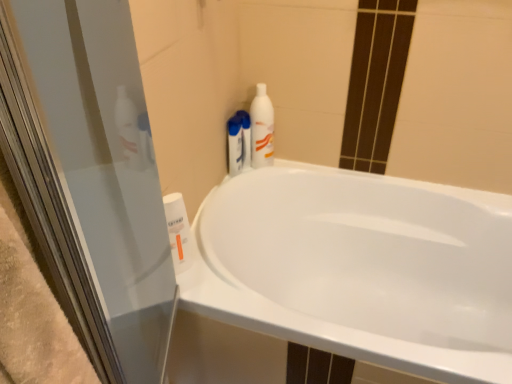
Question: Is white glossy bottle at upper right, which appears as the 2th cleaning product when viewed from the top, positioned behind white glossy bottle at upper right, the first cleaning product viewed from the right?

Choices:
 (A) no
 (B) yes

Answer: (B)

Question: Considering the relative sizes of white glossy bottle at upper right, positioned as the 2th cleaning product in bottom-to-top order, and white glossy bottle at upper right, which is the second cleaning product from front to back, in the image provided, is white glossy bottle at upper right, positioned as the 2th cleaning product in bottom-to-top order, shorter than white glossy bottle at upper right, which is the second cleaning product from front to back,?

Choices:
 (A) no
 (B) yes

Answer: (B)

Question: Considering the relative sizes of white glossy bottle at upper right, which appears as the 2th cleaning product when viewed from the top, and white glossy bottle at upper right, the second cleaning product viewed from the back, in the image provided, is white glossy bottle at upper right, which appears as the 2th cleaning product when viewed from the top, wider than white glossy bottle at upper right, the second cleaning product viewed from the back,?

Choices:
 (A) no
 (B) yes

Answer: (A)

Question: Are white glossy bottle at upper right, positioned as the 2th cleaning product in bottom-to-top order, and white glossy bottle at upper right, the second cleaning product viewed from the back, making contact?

Choices:
 (A) no
 (B) yes

Answer: (B)

Question: Considering the relative sizes of white glossy bottle at upper right, arranged as the second cleaning product when viewed from the left, and white glossy bottle at upper right, which is counted as the third cleaning product, starting from the left, in the image provided, is white glossy bottle at upper right, arranged as the second cleaning product when viewed from the left, taller than white glossy bottle at upper right, which is counted as the third cleaning product, starting from the left,?

Choices:
 (A) no
 (B) yes

Answer: (A)

Question: Considering the relative positions of white glossy bathtub at center and white glossy bottle at lower left, the third cleaning product positioned from the back, in the image provided, is white glossy bathtub at center to the left or to the right of white glossy bottle at lower left, the third cleaning product positioned from the back,?

Choices:
 (A) right
 (B) left

Answer: (A)

Question: Considering the positions of point (243, 296) and point (165, 206), is point (243, 296) closer or farther from the camera than point (165, 206)?

Choices:
 (A) closer
 (B) farther

Answer: (B)

Question: From a real-world perspective, is white glossy bathtub at center positioned above or below white glossy bottle at lower left, the third cleaning product positioned from the back?

Choices:
 (A) above
 (B) below

Answer: (B)

Question: Is white glossy bathtub at center situated inside white glossy bottle at lower left, which is the 1th cleaning product in front-to-back order, or outside?

Choices:
 (A) outside
 (B) inside

Answer: (A)

Question: From the image's perspective, is white glossy bottle at lower left, placed as the third cleaning product when sorted from top to bottom, above or below white glossy bottle at upper right, positioned as the 2th cleaning product in bottom-to-top order?

Choices:
 (A) above
 (B) below

Answer: (B)

Question: Visually, is white glossy bottle at lower left, which ranks as the first cleaning product in left-to-right order, positioned to the left or to the right of white glossy bottle at upper right, the third cleaning product when ordered from front to back?

Choices:
 (A) right
 (B) left

Answer: (B)

Question: From their relative heights in the image, would you say white glossy bottle at lower left, the third cleaning product when ordered from right to left, is taller or shorter than white glossy bottle at upper right, arranged as the second cleaning product when viewed from the left?

Choices:
 (A) tall
 (B) short

Answer: (A)

Question: Is white glossy bottle at lower left, the third cleaning product when ordered from right to left, inside the boundaries of white glossy bottle at upper right, the third cleaning product when ordered from front to back, or outside?

Choices:
 (A) inside
 (B) outside

Answer: (B)

Question: Which is correct: white glossy bottle at lower left, the third cleaning product when ordered from right to left, is inside white glossy bottle at upper right, which is the 3th cleaning product in bottom-to-top order, or outside of it?

Choices:
 (A) inside
 (B) outside

Answer: (B)

Question: Is point (188, 238) closer or farther from the camera than point (260, 140)?

Choices:
 (A) farther
 (B) closer

Answer: (B)